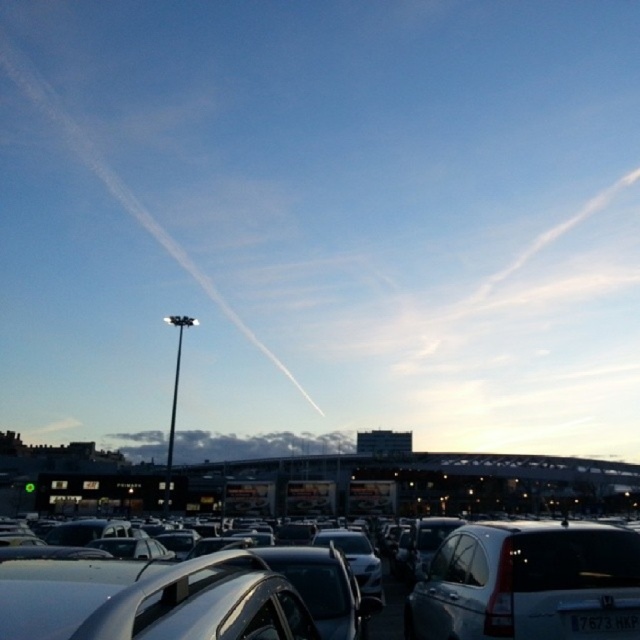
Describe the element at coordinates (529, 582) in the screenshot. I see `white matte sedan at lower right` at that location.

Is white matte sedan at lower right closer to the viewer compared to white plastic license plate at center?

Yes, it is.

Between point (589, 625) and point (570, 630), which one is positioned in front?

Positioned in front is point (570, 630).

This screenshot has width=640, height=640. I want to click on white matte sedan at lower right, so click(x=529, y=582).

Does silver metallic car at center appear on the left side of white plastic license plate at center?

Correct, you'll find silver metallic car at center to the left of white plastic license plate at center.

Which is behind, point (173, 620) or point (580, 625)?

Positioned behind is point (580, 625).

What do you see at coordinates (152, 600) in the screenshot?
I see `silver metallic car at center` at bounding box center [152, 600].

The image size is (640, 640). In order to click on silver metallic car at center in this screenshot , I will do `click(152, 600)`.

Can you confirm if silver metallic car at center is positioned to the right of white matte sedan at lower right?

Incorrect, silver metallic car at center is not on the right side of white matte sedan at lower right.

The width and height of the screenshot is (640, 640). Find the location of `silver metallic car at center`. silver metallic car at center is located at coordinates (152, 600).

Does point (13, 637) lie in front of point (525, 637)?

Yes, point (13, 637) is in front of point (525, 637).

You are a GUI agent. You are given a task and a screenshot of the screen. Output one action in this format:
    pyautogui.click(x=<x>, y=<y>)
    Task: Click on the silver metallic car at center
    
    Given the screenshot: What is the action you would take?
    pyautogui.click(x=152, y=600)